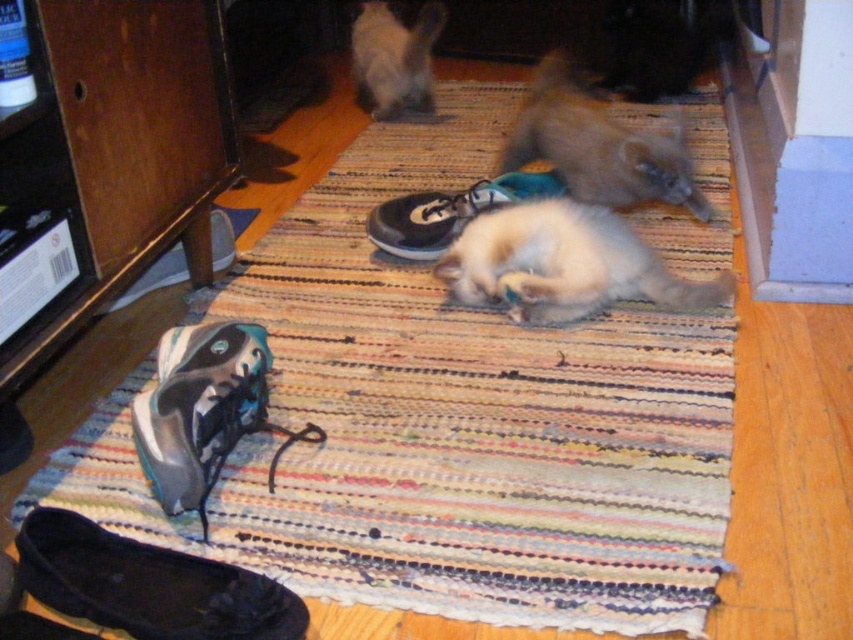
Which of these two, fluffy white cat at center or black suede shoe at center, stands taller?

fluffy white cat at center

Does fluffy white cat at center have a lesser width compared to black suede shoe at center?

No.

Is point (642, 275) positioned behind point (392, 237)?

No.

Identify the location of fluffy white cat at center. Image resolution: width=853 pixels, height=640 pixels. (564, 262).

Is shiny blue sneaker at lower left positioned in front of fuzzy brown cat at center?

Yes, shiny blue sneaker at lower left is closer to the viewer.

Measure the distance between shiny blue sneaker at lower left and camera.

shiny blue sneaker at lower left is 4.39 feet away from camera.

Measure the distance between point (181, 435) and camera.

Point (181, 435) is 1.37 meters from camera.

I want to click on shiny blue sneaker at lower left, so click(x=204, y=410).

Consider the image. Does black suede running shoe at lower left have a greater width compared to fuzzy brown cat at center?

In fact, black suede running shoe at lower left might be narrower than fuzzy brown cat at center.

At what (x,y) coordinates should I click in order to perform the action: click on black suede running shoe at lower left. Please return your answer as a coordinate pair (x, y). The width and height of the screenshot is (853, 640). Looking at the image, I should click on (148, 584).